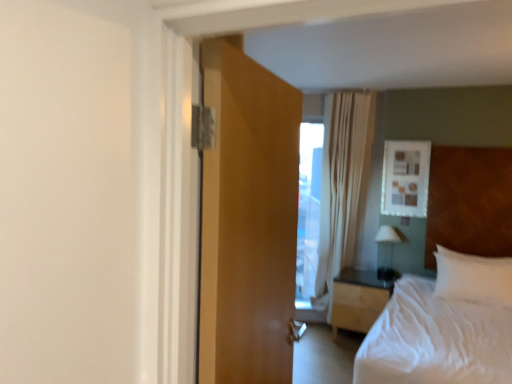
Image resolution: width=512 pixels, height=384 pixels. In order to click on free space above white sheer curtain at upper center (from a real-world perspective) in this screenshot , I will do `click(339, 89)`.